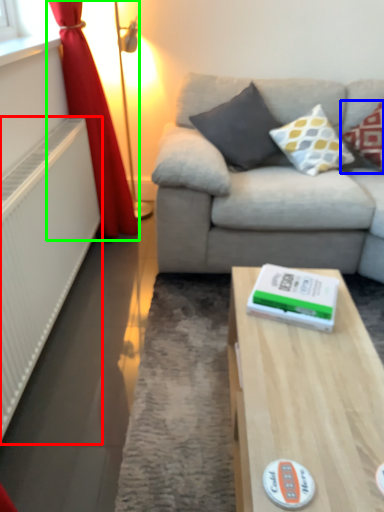
Question: Which is farther away from radiator (highlighted by a red box)? pillow (highlighted by a blue box) or curtain (highlighted by a green box)?

Choices:
 (A) pillow
 (B) curtain

Answer: (A)